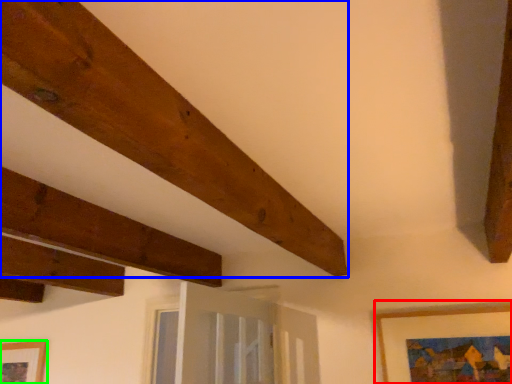
Question: Which object is the closest to the picture frame (highlighted by a red box)? Choose among these: plank (highlighted by a blue box) or picture frame (highlighted by a green box).

Choices:
 (A) plank
 (B) picture frame

Answer: (A)